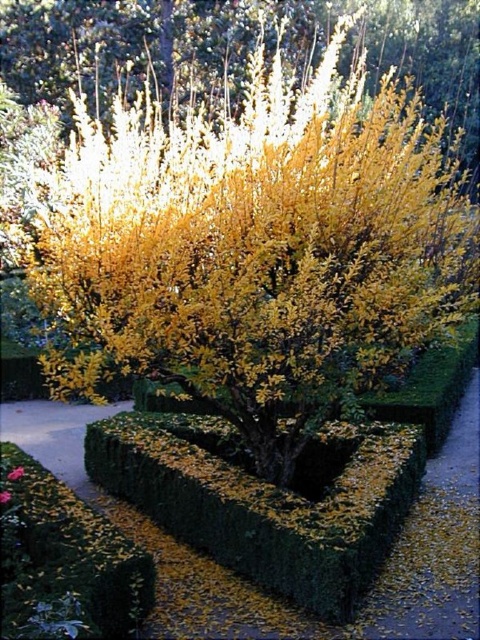
Can you confirm if green hedge at center is thinner than vivid pink petal at center?

In fact, green hedge at center might be wider than vivid pink petal at center.

Between point (387, 490) and point (6, 493), which one is positioned in front?

Point (6, 493) is in front.

The width and height of the screenshot is (480, 640). In order to click on green hedge at center in this screenshot , I will do (x=263, y=502).

Does yellow leafy bush at upper center have a smaller size compared to vivid pink petals at center?

No, yellow leafy bush at upper center is not smaller than vivid pink petals at center.

Who is lower down, yellow leafy bush at upper center or vivid pink petals at center?

vivid pink petals at center is below.

Does point (289, 96) lie in front of point (23, 472)?

No.

You are a GUI agent. You are given a task and a screenshot of the screen. Output one action in this format:
    pyautogui.click(x=<x>, y=<y>)
    Task: Click on the yellow leafy bush at upper center
    
    Given the screenshot: What is the action you would take?
    pyautogui.click(x=255, y=241)

Is point (175, 292) farther from camera compared to point (2, 502)?

No, it is in front of (2, 502).

From the picture: Is yellow leafy bush at upper center behind vivid pink petal at center?

Yes, it is behind vivid pink petal at center.

Between point (389, 244) and point (2, 497), which one is positioned in front?

Positioned in front is point (2, 497).

This screenshot has width=480, height=640. Identify the location of yellow leafy bush at upper center. pyautogui.click(x=255, y=241).